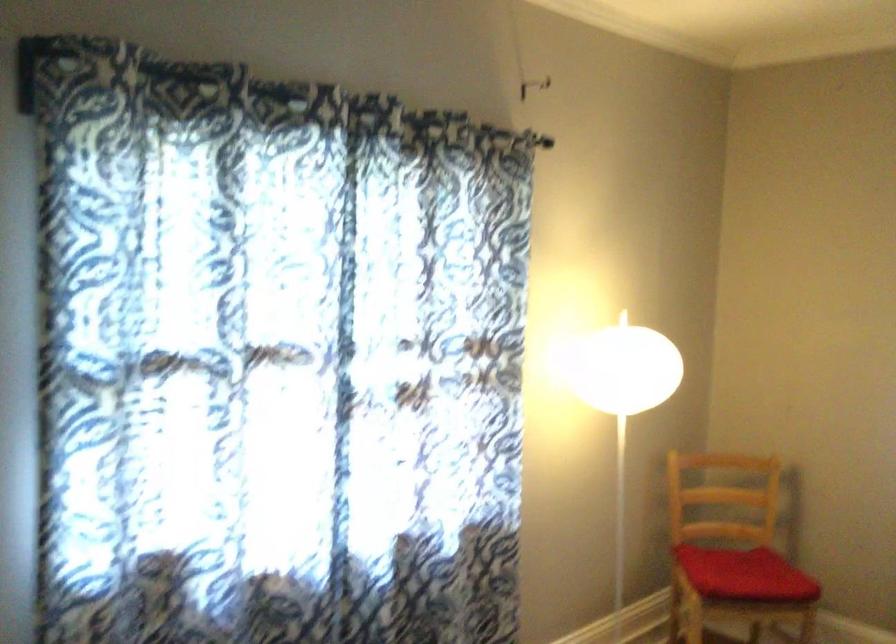
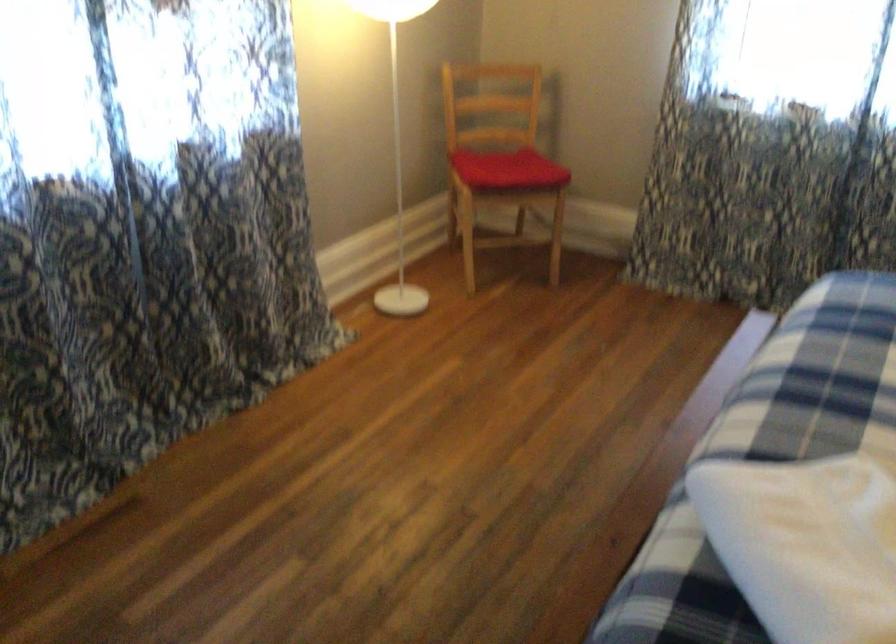
Question: What movement of the cameraman would produce the second image?

Choices:
 (A) Left
 (B) Right
 (C) Forward
 (D) Backward

Answer: (D)